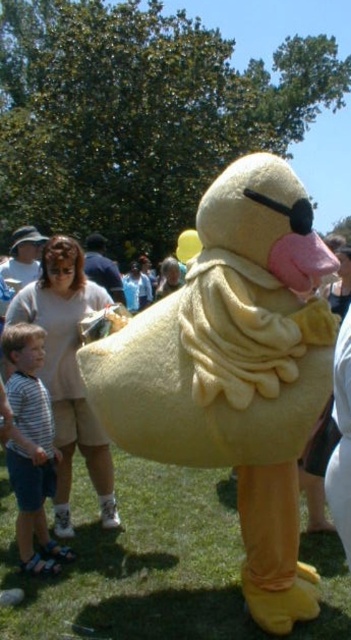
Which is more to the right, yellow plush duck at center or striped fabric shirt at lower left?

yellow plush duck at center is more to the right.

Is yellow plush duck at center shorter than striped fabric shirt at lower left?

In fact, yellow plush duck at center may be taller than striped fabric shirt at lower left.

Who is more distant from viewer, (217, 260) or (41, 540)?

Point (41, 540)

You are a GUI agent. You are given a task and a screenshot of the screen. Output one action in this format:
    pyautogui.click(x=<x>, y=<y>)
    Task: Click on the yellow plush duck at center
    The width and height of the screenshot is (351, 640).
    Given the screenshot: What is the action you would take?
    pyautogui.click(x=235, y=371)